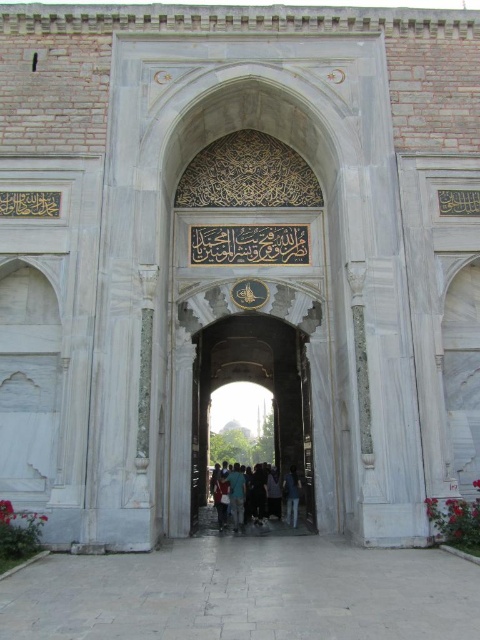
Based on the photo, is white marble archway at center further to camera compared to light blue jeans at center?

No, white marble archway at center is closer to the viewer.

Does point (233, 330) come closer to viewer compared to point (288, 513)?

No.

Is point (302, 369) positioned before point (299, 484)?

Yes, point (302, 369) is in front of point (299, 484).

The height and width of the screenshot is (640, 480). I want to click on white marble archway at center, so click(256, 384).

Between white marble archway at center and dark blue jeans at center, which one appears on the right side from the viewer's perspective?

From the viewer's perspective, dark blue jeans at center appears more on the right side.

Is point (297, 390) more distant than point (277, 497)?

Yes, it is behind point (277, 497).

You are a GUI agent. You are given a task and a screenshot of the screen. Output one action in this format:
    pyautogui.click(x=<x>, y=<y>)
    Task: Click on the white marble archway at center
    
    Given the screenshot: What is the action you would take?
    pyautogui.click(x=256, y=384)

Is dark blue jeans at center below light blue jeans at center?

Indeed, dark blue jeans at center is positioned under light blue jeans at center.

Does point (217, 477) come closer to viewer compared to point (295, 474)?

That is False.

Is point (230, 499) behind point (295, 492)?

That is False.

Where is `dark blue jeans at center`? dark blue jeans at center is located at coordinates (248, 493).